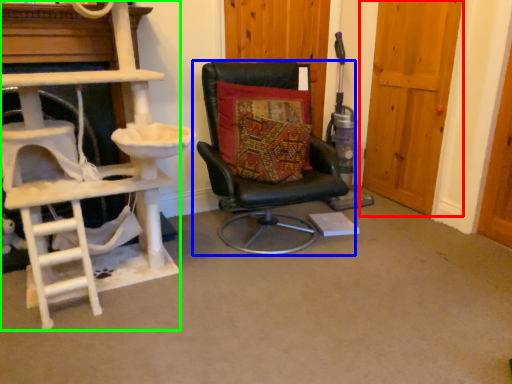
Question: Considering the real-world distances, which object is closest to door (highlighted by a red box)? chair (highlighted by a blue box) or ladder (highlighted by a green box).

Choices:
 (A) chair
 (B) ladder

Answer: (A)